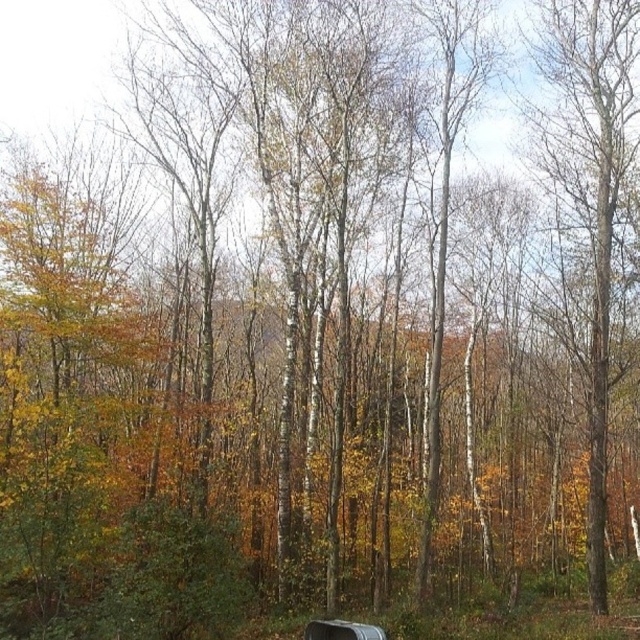
Describe the element at coordinates (589, 188) in the screenshot. The height and width of the screenshot is (640, 640). I see `smooth bark tree at right` at that location.

Can you confirm if smooth bark tree at right is bigger than metallic silver bench at lower center?

Incorrect, smooth bark tree at right is not larger than metallic silver bench at lower center.

Identify the location of smooth bark tree at right. (589, 188).

The height and width of the screenshot is (640, 640). Find the location of `smooth bark tree at right`. smooth bark tree at right is located at coordinates (589, 188).